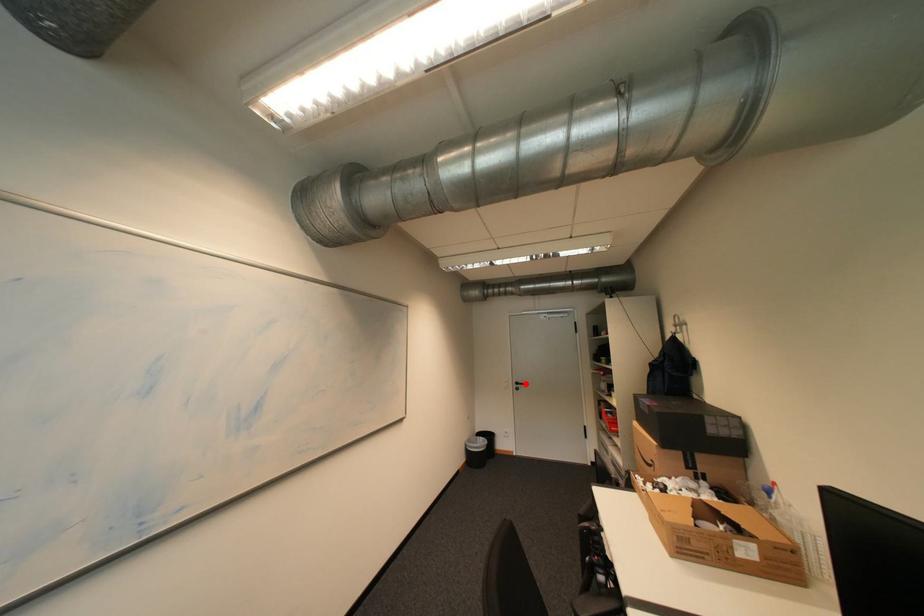
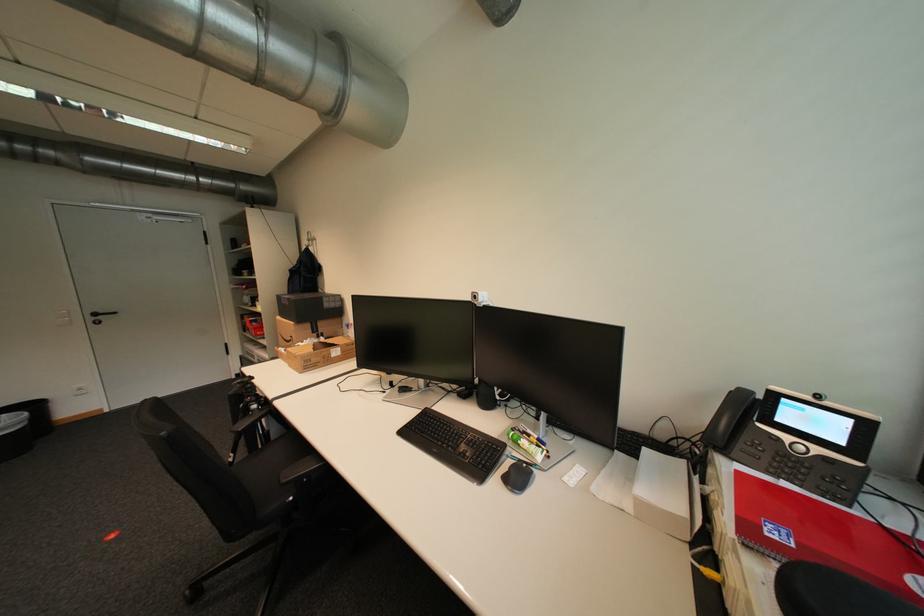
Find the pixel in the second image that matches the highlighted location in the first image.

(103, 315)